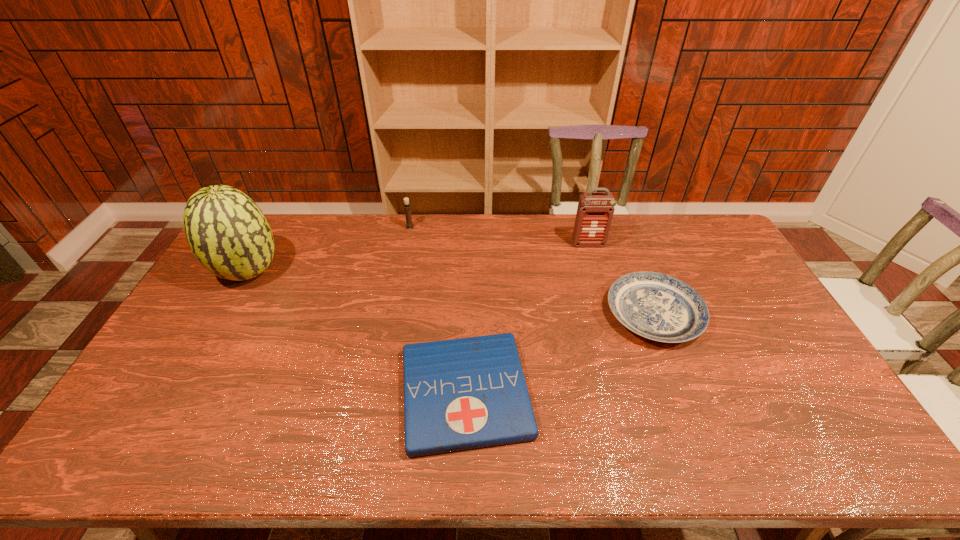
This screenshot has width=960, height=540. In order to click on empty location between the plate and the second object from left to right in this screenshot , I will do `click(532, 270)`.

Identify the location of empty space between the watermelon and the right first-aid kit. Image resolution: width=960 pixels, height=540 pixels. (419, 258).

Locate an element on the screen. Image resolution: width=960 pixels, height=540 pixels. empty space that is in between the taller first-aid kit and the tallest object is located at coordinates (419, 258).

Identify the location of vacant region between the shortest object and the leftmost object. The width and height of the screenshot is (960, 540). (357, 333).

You are a GUI agent. You are given a task and a screenshot of the screen. Output one action in this format:
    pyautogui.click(x=<x>, y=<y>)
    Task: Click on the blank region between the third object from left to right and the right first-aid kit
    The image size is (960, 540).
    Given the screenshot: What is the action you would take?
    pyautogui.click(x=527, y=319)

Identify which object is located as the fourth nearest to the second shortest object. Please provide its 2D coordinates. Your answer should be formatted as a tuple, i.e. [(x, y)], where the tuple contains the x and y coordinates of a point satisfying the conditions above.

[(227, 232)]

At what (x,y) coordinates should I click in order to perform the action: click on object that stands as the fourth closest to the fourth shortest object. Please return your answer as a coordinate pair (x, y). Image resolution: width=960 pixels, height=540 pixels. Looking at the image, I should click on (227, 232).

The width and height of the screenshot is (960, 540). Identify the location of free spot that satisfies the following two spatial constraints: 1. on the back side of the shortest object; 2. on the right side of the second shortest object. pyautogui.click(x=468, y=314).

This screenshot has width=960, height=540. Identify the location of free region that satisfies the following two spatial constraints: 1. on the front-facing side of the fourth tallest object; 2. on the right side of the fourth nearest object. (609, 314).

You are a GUI agent. You are given a task and a screenshot of the screen. Output one action in this format:
    pyautogui.click(x=<x>, y=<y>)
    Task: Click on the free location that satisfies the following two spatial constraints: 1. on the front-facing side of the taller first-aid kit; 2. on the left side of the second shortest object
    Image resolution: width=960 pixels, height=540 pixels.
    Given the screenshot: What is the action you would take?
    pyautogui.click(x=609, y=314)